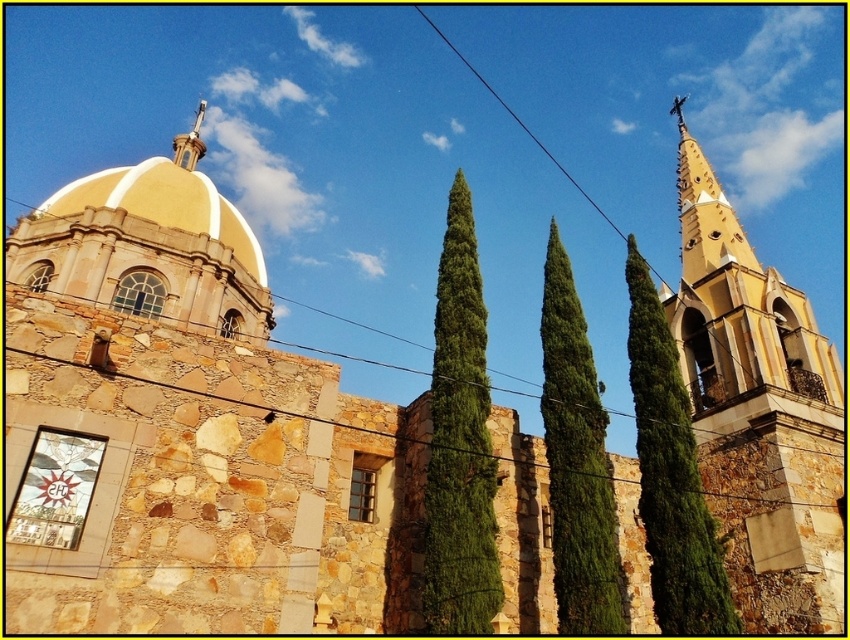
Between green textured tree at right and green textured tree at center, which one is positioned lower?

green textured tree at center is below.

Does green textured tree at right appear on the right side of green textured tree at center?

Yes, green textured tree at right is to the right of green textured tree at center.

Which is in front, point (686, 438) or point (581, 458)?

Point (581, 458) is in front.

Where is `green textured tree at right`? This screenshot has height=640, width=850. green textured tree at right is located at coordinates (672, 474).

Does yellow stucco bell tower at upper right appear on the left side of green textured tree at right?

In fact, yellow stucco bell tower at upper right is to the right of green textured tree at right.

Does yellow stucco bell tower at upper right have a smaller size compared to green textured tree at right?

No, yellow stucco bell tower at upper right is not smaller than green textured tree at right.

Where is `yellow stucco bell tower at upper right`? This screenshot has height=640, width=850. yellow stucco bell tower at upper right is located at coordinates (737, 301).

Is point (701, 230) closer to viewer compared to point (177, 224)?

That is True.

Is yellow stucco bell tower at upper right taller than golden stone dome at upper center?

Indeed, yellow stucco bell tower at upper right has a greater height compared to golden stone dome at upper center.

Image resolution: width=850 pixels, height=640 pixels. Identify the location of yellow stucco bell tower at upper right. (737, 301).

Image resolution: width=850 pixels, height=640 pixels. In order to click on yellow stucco bell tower at upper right in this screenshot , I will do `click(737, 301)`.